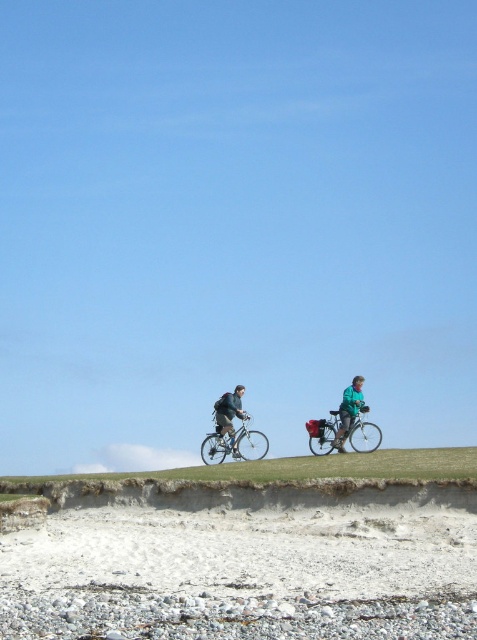
Question: Among these points, which one is nearest to the camera?

Choices:
 (A) (228, 417)
 (B) (324, 452)
 (C) (259, 429)
 (D) (133, 548)

Answer: (D)

Question: Which of the following is the farthest from the observer?

Choices:
 (A) shiny silver bicycle at center
 (B) green grassy hill at center

Answer: (A)

Question: Does shiny silver bicycle at center come behind teal fabric jacket at center?

Choices:
 (A) yes
 (B) no

Answer: (A)

Question: Is green grassy hill at center in front of shiny silver bicycle at center?

Choices:
 (A) yes
 (B) no

Answer: (A)

Question: Considering the relative positions of smooth sand at center and metallic silver bicycle at center in the image provided, where is smooth sand at center located with respect to metallic silver bicycle at center?

Choices:
 (A) left
 (B) right

Answer: (A)

Question: Which of the following is the farthest from the observer?

Choices:
 (A) (411, 474)
 (B) (273, 481)
 (C) (231, 445)

Answer: (C)